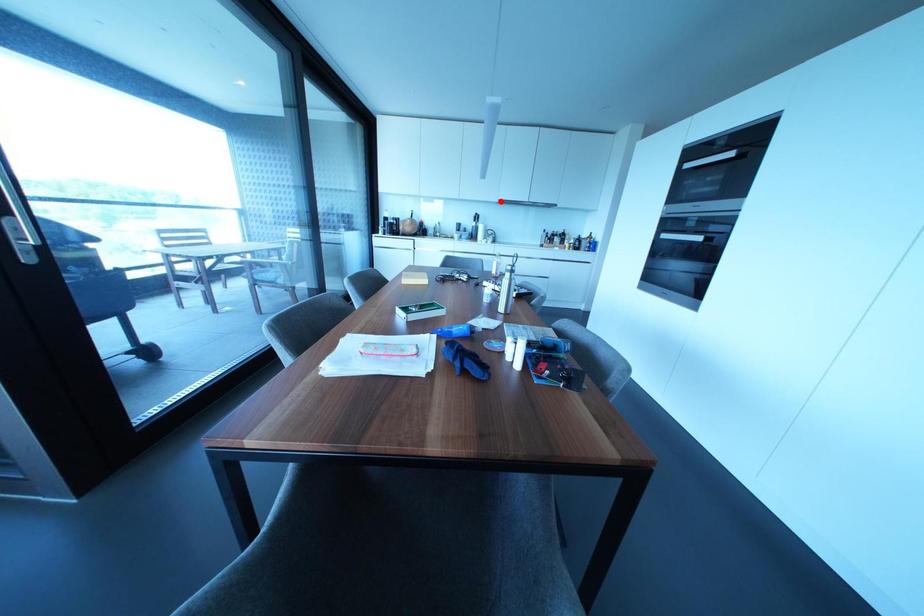
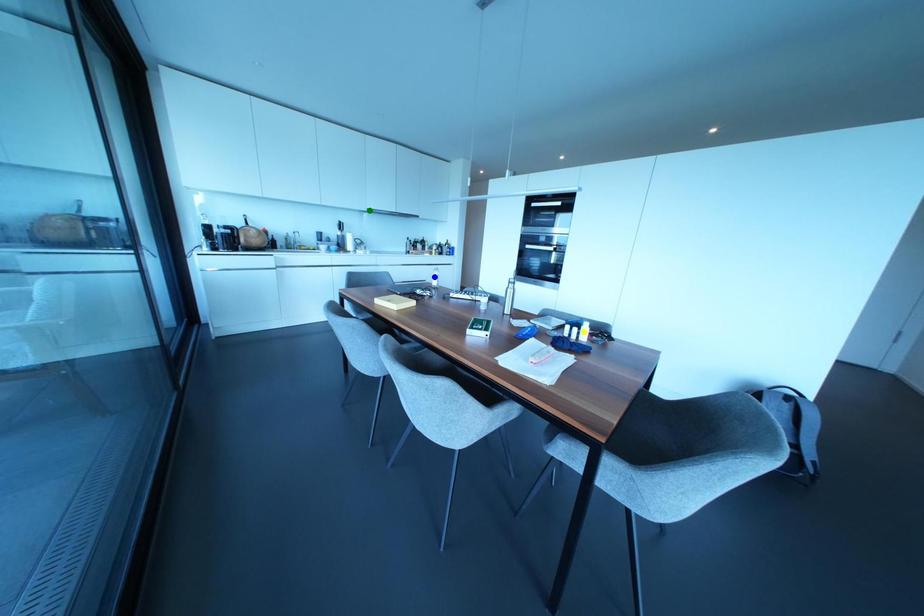
Question: I am providing you with two images of the same scene from different viewpoints. A red point is marked on the first image. You are given multiple points on the second image. In image 2, which mark is for the same physical point as the one in image 1?

Choices:
 (A) yellow point
 (B) blue point
 (C) green point

Answer: (C)